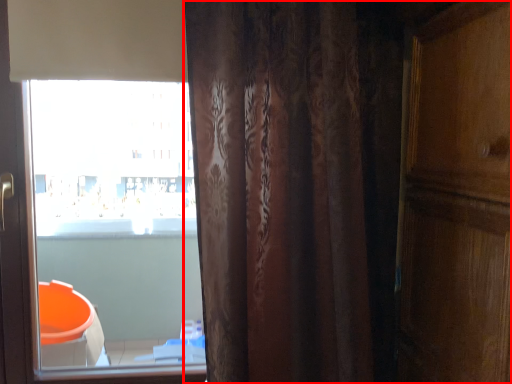
Question: Where is curtain (annotated by the red box) located in relation to window in the image?

Choices:
 (A) right
 (B) left

Answer: (A)